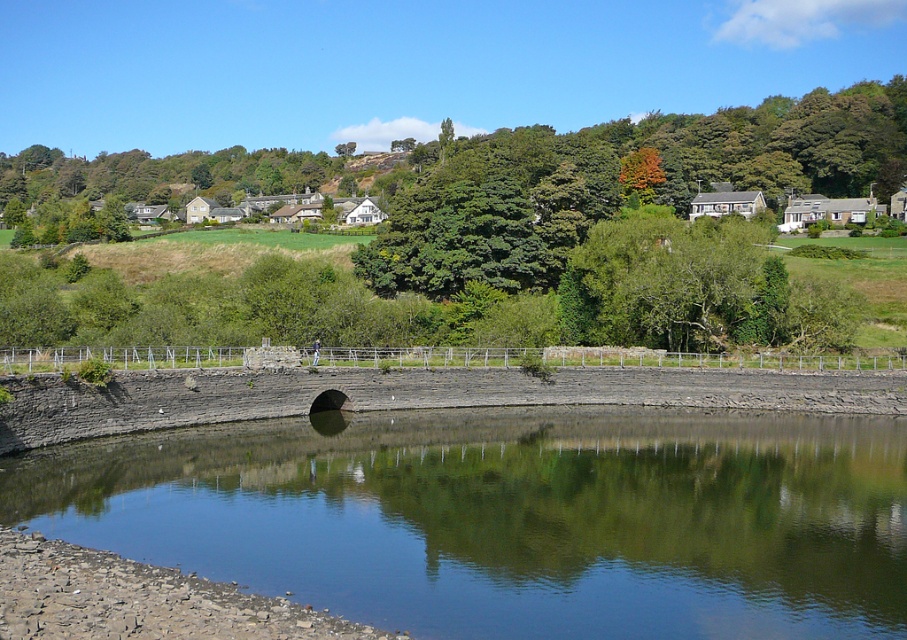
You are a photographer planning to capture the clear water at center and the green leafy tree at upper center in a single frame. Which object should you focus on first if you want to ensure both are in focus, considering their sizes in the image?

You should focus on the green leafy tree at upper center first because it is larger in the image than the clear water at center. Larger objects generally require more precise focusing to ensure all details are sharp.

You are a landscape architect designing a new garden. You want to place a small statue exactly between the clear water at center and the green leafy tree at center. Given their relative sizes, which object will the statue be closer to?

The statue will be closer to the green leafy tree at center because the clear water at center has a larger width, meaning the distance between them would be greater near the tree.